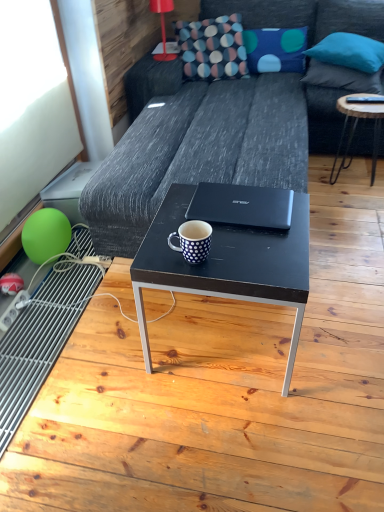
Where is `empty space that is ontop of black matte laptop at center`? The width and height of the screenshot is (384, 512). empty space that is ontop of black matte laptop at center is located at coordinates (252, 201).